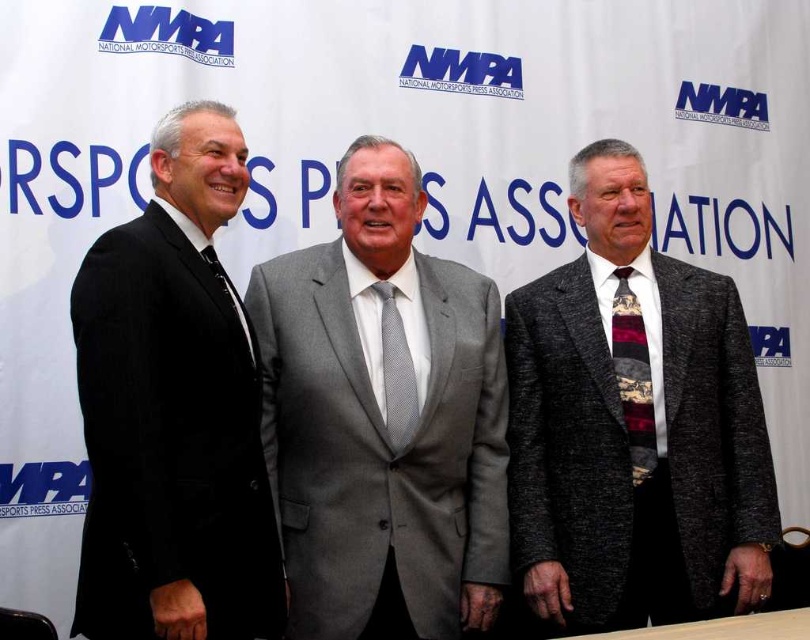
Which is behind, point (97, 301) or point (245, 324)?

Positioned behind is point (245, 324).

Does black suit at left have a lesser width compared to matte black tie at left?

Incorrect, black suit at left's width is not less than matte black tie at left's.

Does point (84, 384) come closer to viewer compared to point (216, 268)?

Yes, it is in front of point (216, 268).

Where is `black suit at left`? This screenshot has height=640, width=810. black suit at left is located at coordinates (173, 410).

Which is above, gray textured suit at center or black suit at left?

black suit at left is higher up.

At what (x,y) coordinates should I click in order to perform the action: click on gray textured suit at center. Please return your answer as a coordinate pair (x, y). The height and width of the screenshot is (640, 810). Looking at the image, I should click on (634, 424).

You are a GUI agent. You are given a task and a screenshot of the screen. Output one action in this format:
    pyautogui.click(x=<x>, y=<y>)
    Task: Click on the gray textured suit at center
    The image size is (810, 640).
    Given the screenshot: What is the action you would take?
    pyautogui.click(x=634, y=424)

Does gray textured suit at center have a greater height compared to multicolored woven tie at right?

Yes, gray textured suit at center is taller than multicolored woven tie at right.

The image size is (810, 640). Describe the element at coordinates (634, 424) in the screenshot. I see `gray textured suit at center` at that location.

Find the location of a particular element. The image size is (810, 640). gray textured suit at center is located at coordinates (634, 424).